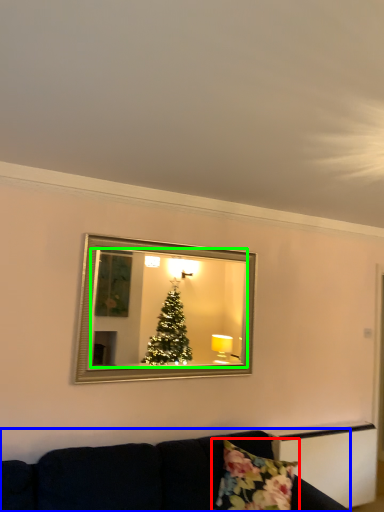
Question: Which object is positioned closest to pillow (highlighted by a red box)? Select from studio couch (highlighted by a blue box) and mirror (highlighted by a green box).

Choices:
 (A) studio couch
 (B) mirror

Answer: (A)